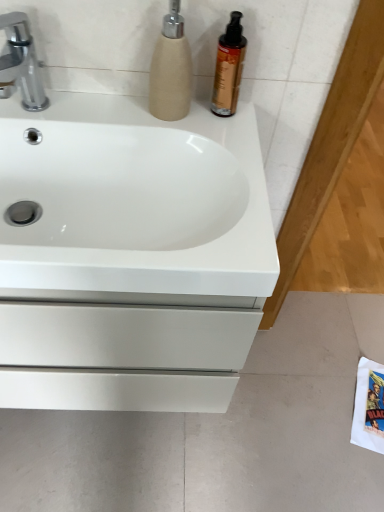
This screenshot has width=384, height=512. Identify the location of free area in between silver metallic faucet at upper left and beige textured soap dispenser at upper center. (104, 111).